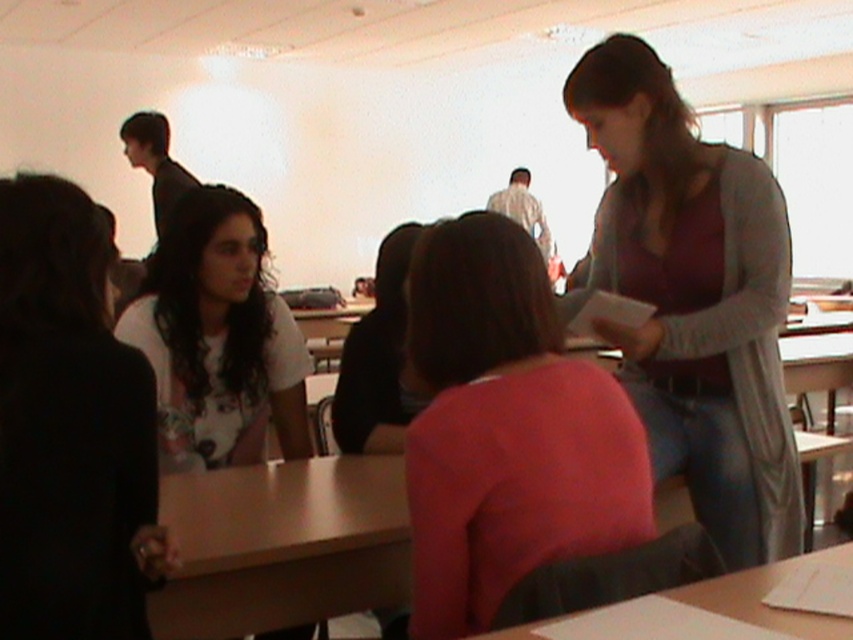
In the classroom scene, there is a woman wearing a long gray cardigan over a maroon top and blue jeans standing at a desk. There is also a pink matte shirt at center. How far apart are these two individuals?

The woman wearing a long gray cardigan over a maroon top and blue jeans and the pink matte shirt at center are 4.22 feet apart.

You are a student sitting in the classroom and looking at the two people standing at the desk. Which person is wearing a taller garment between the gray sweater at right and the white matte shirt at left?

The gray sweater at right has a greater height compared to the white matte shirt at left, so the person wearing the gray sweater at right has a taller garment.

You are a student sitting at the desk in the classroom. You notice two items on the desk in front of you. The gray sweater at right and the white matte shirt at left. Which item is positioned higher on the desk?

The gray sweater at right is located above the white matte shirt at left, so it is positioned higher on the desk.